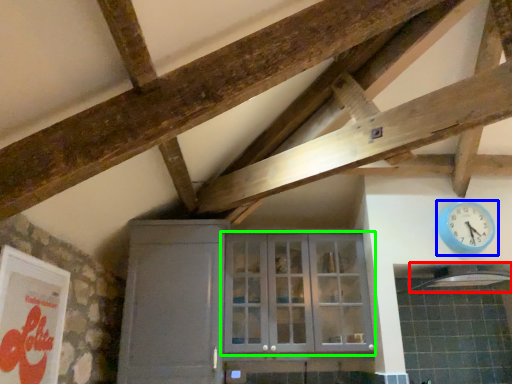
Question: Which is farther away from exhaust hood (highlighted by a red box)? wall clock (highlighted by a blue box) or window (highlighted by a green box)?

Choices:
 (A) wall clock
 (B) window

Answer: (B)